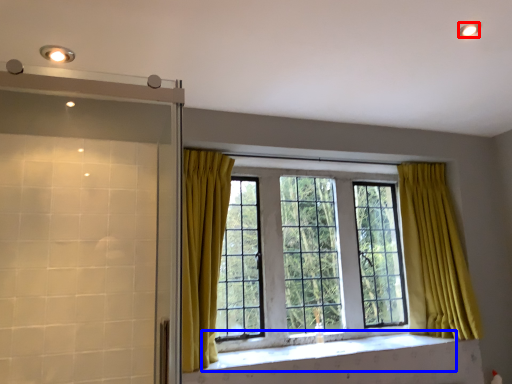
Question: Which object is closer to the camera taking this photo, lighting (highlighted by a red box) or window sill (highlighted by a blue box)?

Choices:
 (A) lighting
 (B) window sill

Answer: (A)